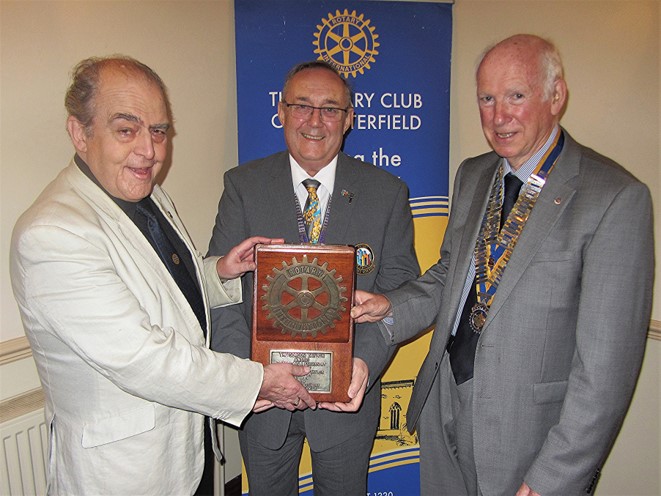
In order to click on award plaque in this screenshot , I will do `click(270, 257)`.